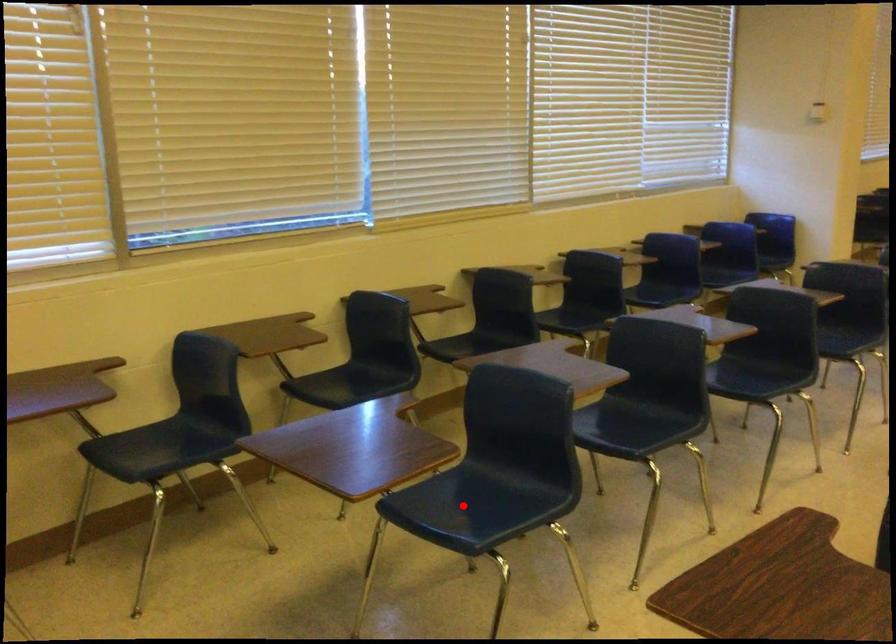
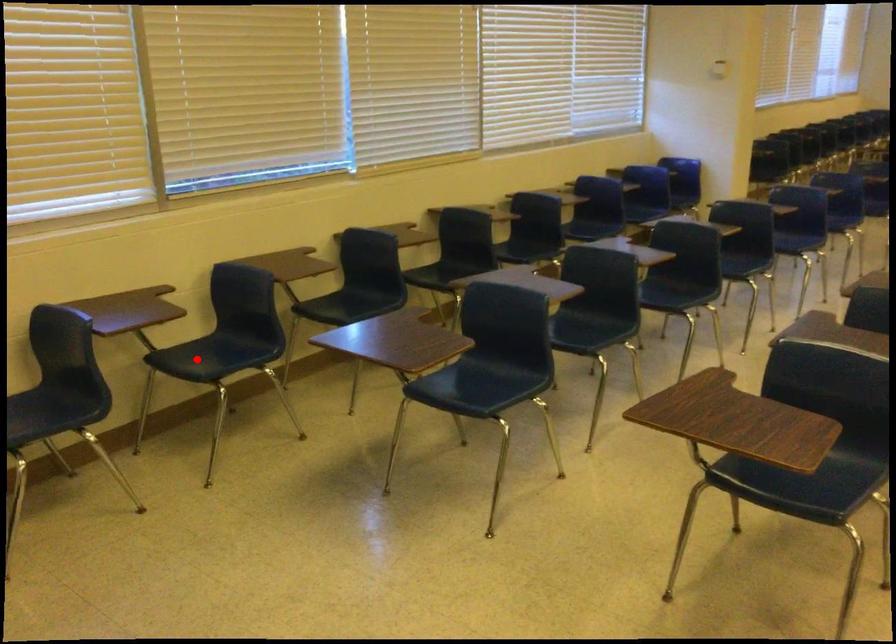
I am providing you with two images of the same scene from different viewpoints. A red point is marked on the first image and another point is marked on the second image. Is the marked point in image1 the same physical position as the marked point in image2?

No